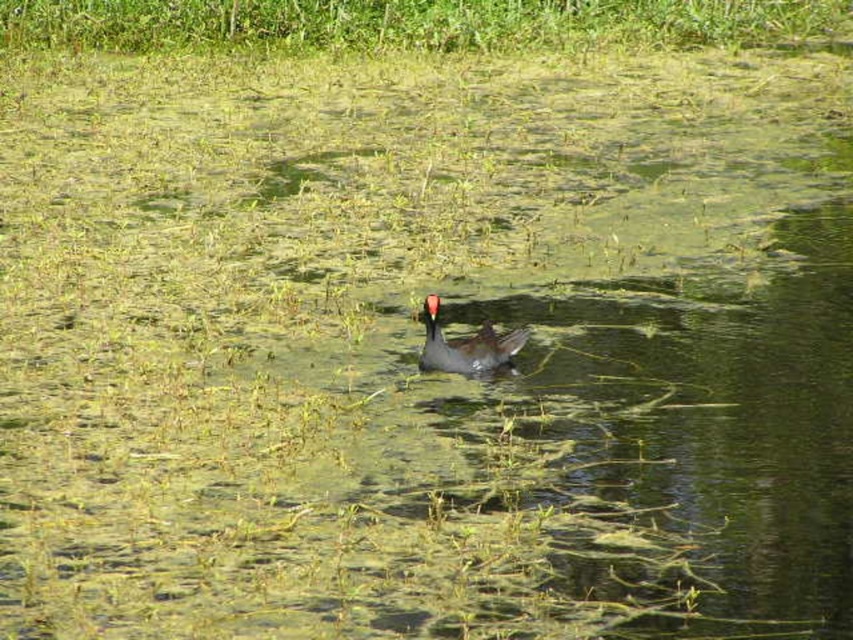
Question: Does green leafy grass at upper center have a smaller size compared to dark gray duck at center?

Choices:
 (A) yes
 (B) no

Answer: (A)

Question: Does green leafy grass at upper center appear under dark gray duck at center?

Choices:
 (A) yes
 (B) no

Answer: (B)

Question: Does green leafy grass at upper center lie behind dark gray duck at center?

Choices:
 (A) yes
 (B) no

Answer: (A)